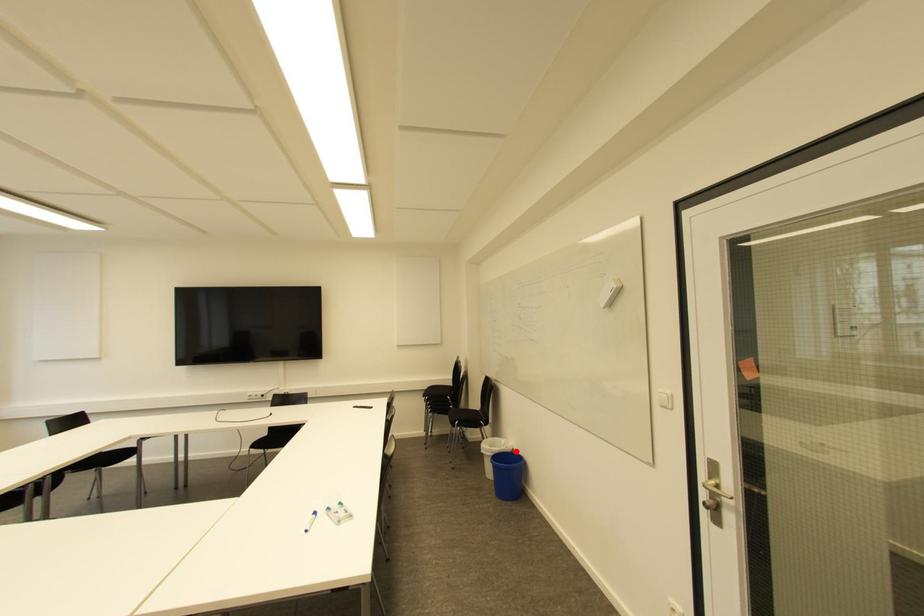
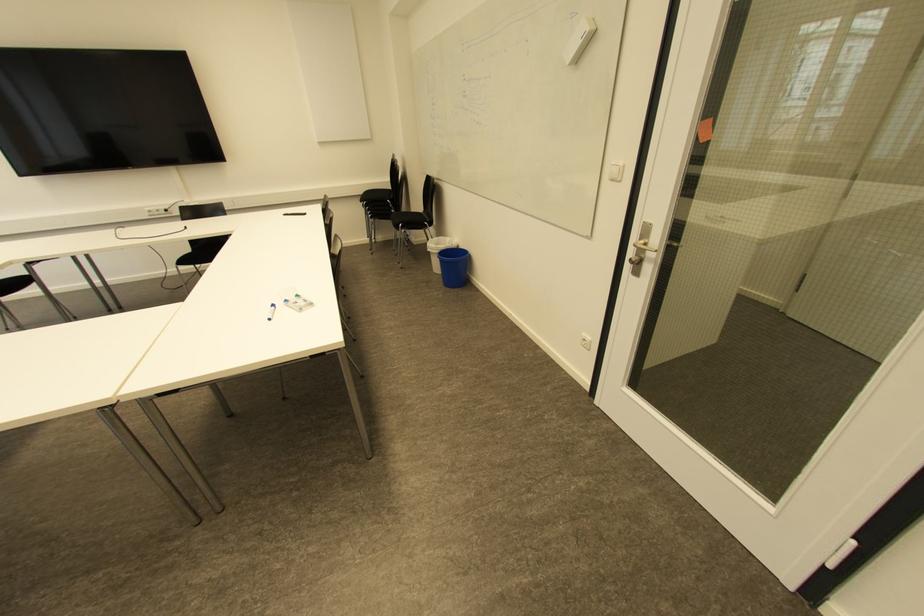
Question: I am providing you with two images of the same scene from different viewpoints. A red point is marked on the first image. At the location where the point appears in image 1, is it still visible in image 2?

Choices:
 (A) Yes
 (B) No

Answer: (A)